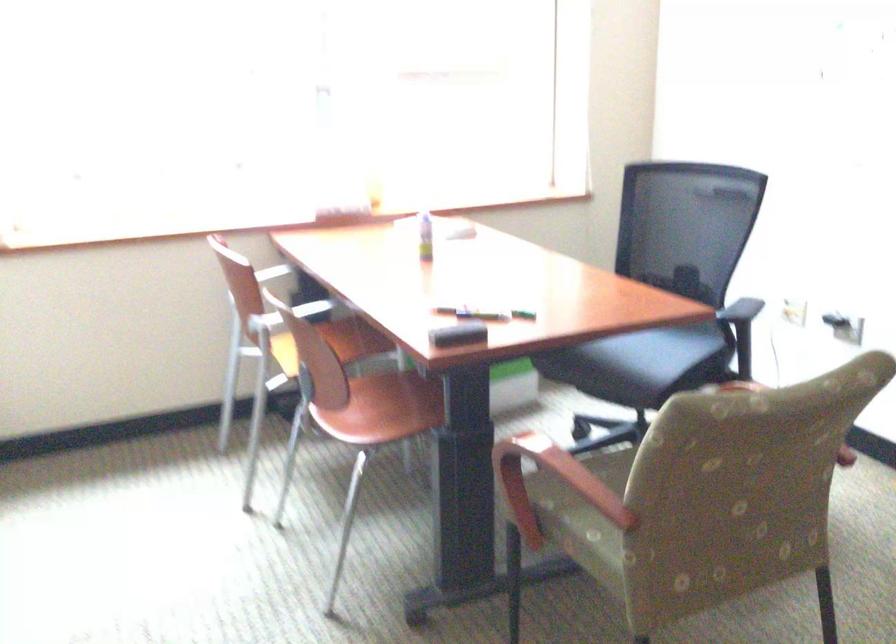
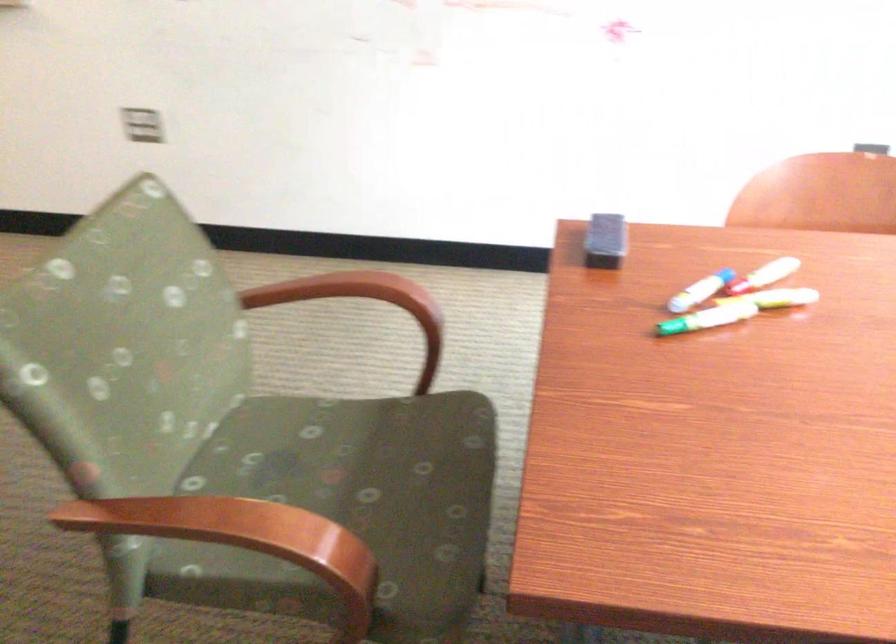
Where in the second image is the point corresponding to point (561, 475) from the first image?

(305, 304)